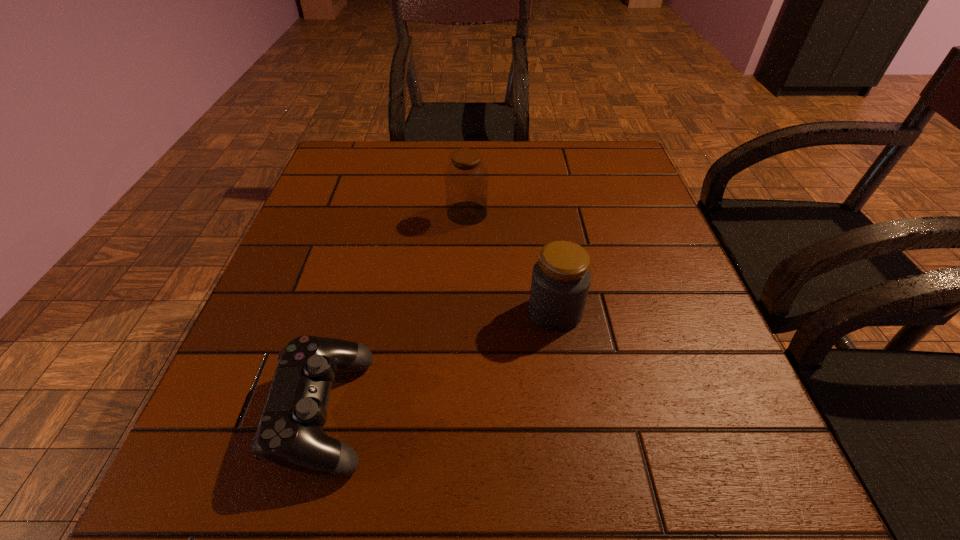
This screenshot has width=960, height=540. Identify the location of free space that is in between the farther jar and the nearest object. (396, 313).

Where is `free space between the right jar and the farther jar`? Image resolution: width=960 pixels, height=540 pixels. free space between the right jar and the farther jar is located at coordinates tap(511, 262).

Choose which object is the second nearest neighbor to the second farthest object. Please provide its 2D coordinates. Your answer should be formatted as a tuple, i.e. [(x, y)], where the tuple contains the x and y coordinates of a point satisfying the conditions above.

[(290, 434)]

Select which object appears as the second closest to the nearer jar. Please provide its 2D coordinates. Your answer should be formatted as a tuple, i.e. [(x, y)], where the tuple contains the x and y coordinates of a point satisfying the conditions above.

[(290, 434)]